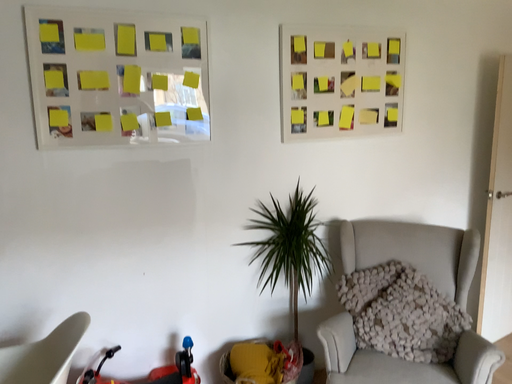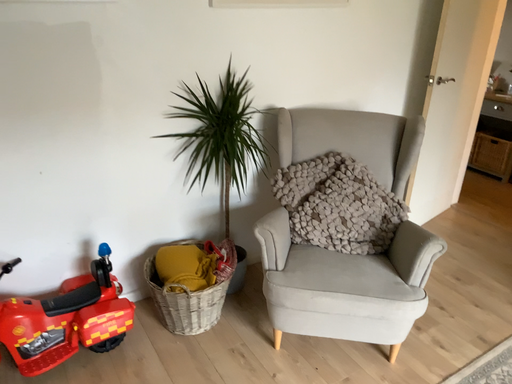
Question: How did the camera likely rotate when shooting the video?

Choices:
 (A) rotated right
 (B) rotated left

Answer: (A)